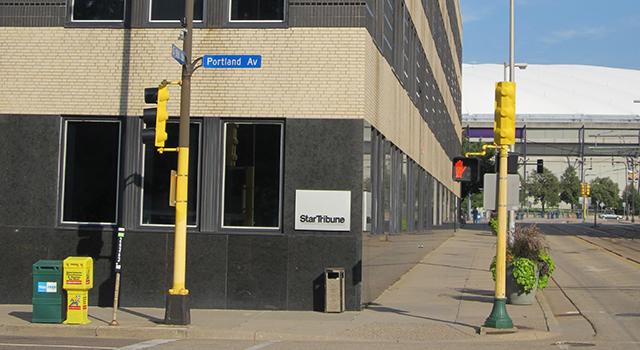
Identify the location of small potted plants. (528, 268), (493, 224).